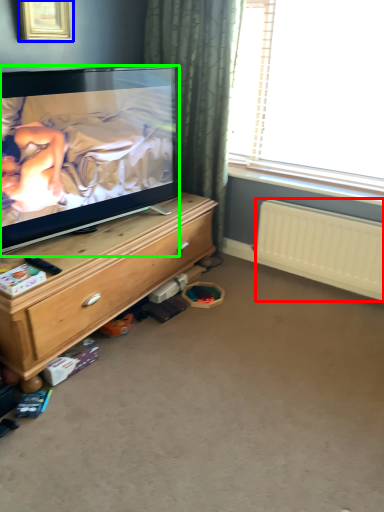
Question: Based on their relative distances, which object is farther from radiator (highlighted by a red box)? Choose from picture frame (highlighted by a blue box) and television (highlighted by a green box).

Choices:
 (A) picture frame
 (B) television

Answer: (A)